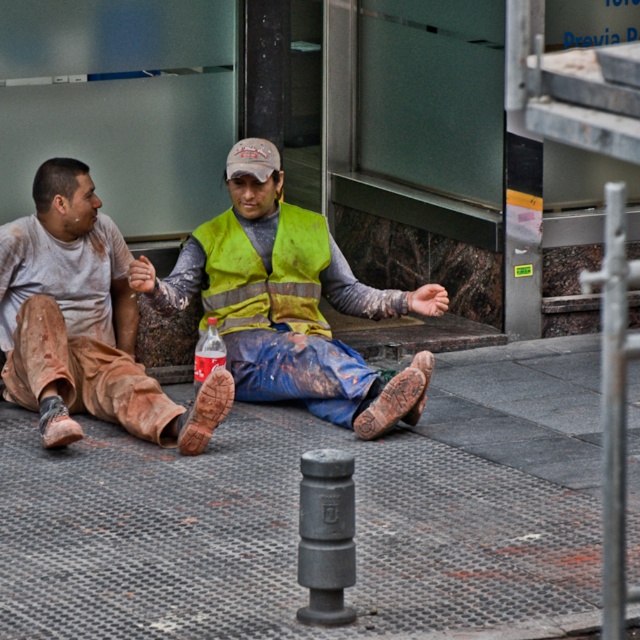
Does gray rubber mat at center have a greater height compared to green reflective safety vest at center?

Correct, gray rubber mat at center is much taller as green reflective safety vest at center.

The image size is (640, 640). What do you see at coordinates (296, 513) in the screenshot?
I see `gray rubber mat at center` at bounding box center [296, 513].

Where is `gray rubber mat at center`? The width and height of the screenshot is (640, 640). gray rubber mat at center is located at coordinates (296, 513).

Does yellow reflective vest at center appear over green reflective safety vest at center?

No, yellow reflective vest at center is not above green reflective safety vest at center.

Can you confirm if yellow reflective vest at center is positioned to the left of green reflective safety vest at center?

In fact, yellow reflective vest at center is to the right of green reflective safety vest at center.

Between point (365, 292) and point (204, 232), which one is positioned behind?

The point (365, 292) is more distant.

This screenshot has height=640, width=640. In order to click on yellow reflective vest at center in this screenshot , I will do `click(289, 301)`.

Does gray rubber mat at center appear on the left side of yellow reflective vest at center?

Incorrect, gray rubber mat at center is not on the left side of yellow reflective vest at center.

Which is in front, point (424, 580) or point (305, 269)?

Point (424, 580) is more forward.

What are the coordinates of `gray rubber mat at center` in the screenshot? It's located at (296, 513).